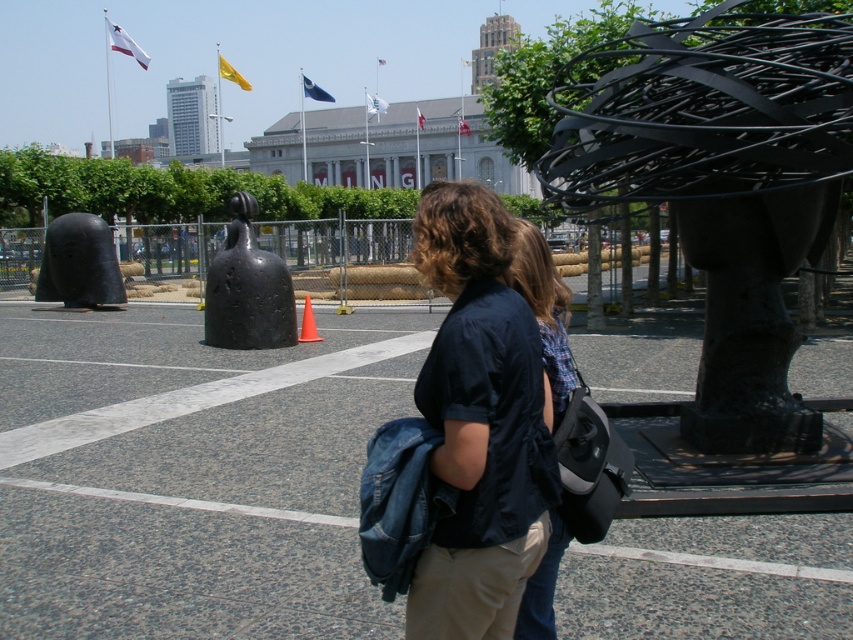
Question: Which object is the farthest from the gray asphalt parking lot at center?

Choices:
 (A) dark blue shirt at center
 (B) orange matte cone at center
 (C) denim jacket at center
 (D) black matte sculpture at left

Answer: (D)

Question: From the image, what is the correct spatial relationship of gray asphalt parking lot at center in relation to black matte sculpture at center?

Choices:
 (A) below
 (B) above

Answer: (A)

Question: Does gray asphalt parking lot at center come in front of orange matte cone at center?

Choices:
 (A) yes
 (B) no

Answer: (A)

Question: Which point is farther to the camera?

Choices:
 (A) [567, 308]
 (B) [438, 380]

Answer: (A)

Question: Among these objects, which one is farthest from the camera?

Choices:
 (A) orange matte cone at center
 (B) denim jacket at center
 (C) gray asphalt parking lot at center
 (D) black wire sculpture at right

Answer: (A)

Question: Does dark blue shirt at center have a larger size compared to denim jacket at center?

Choices:
 (A) yes
 (B) no

Answer: (A)